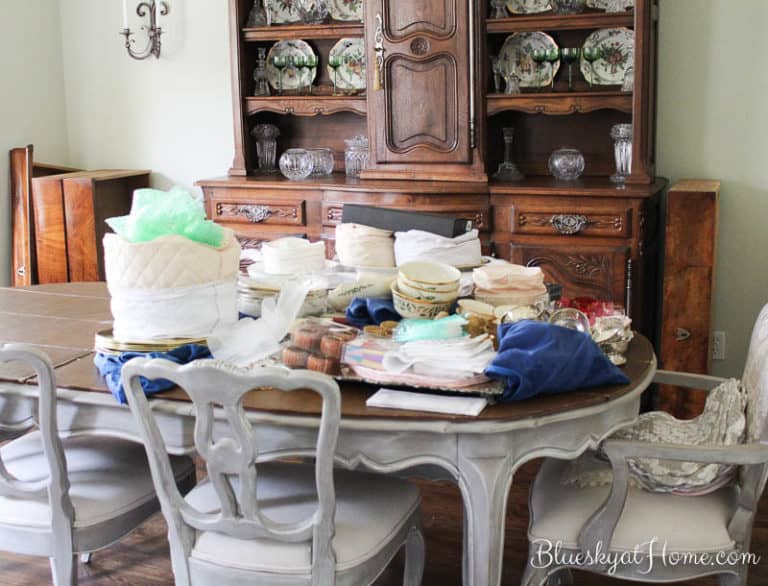
Where is `fabric containers`? The image size is (768, 586). fabric containers is located at coordinates (170, 270), (514, 272), (454, 246), (368, 238).